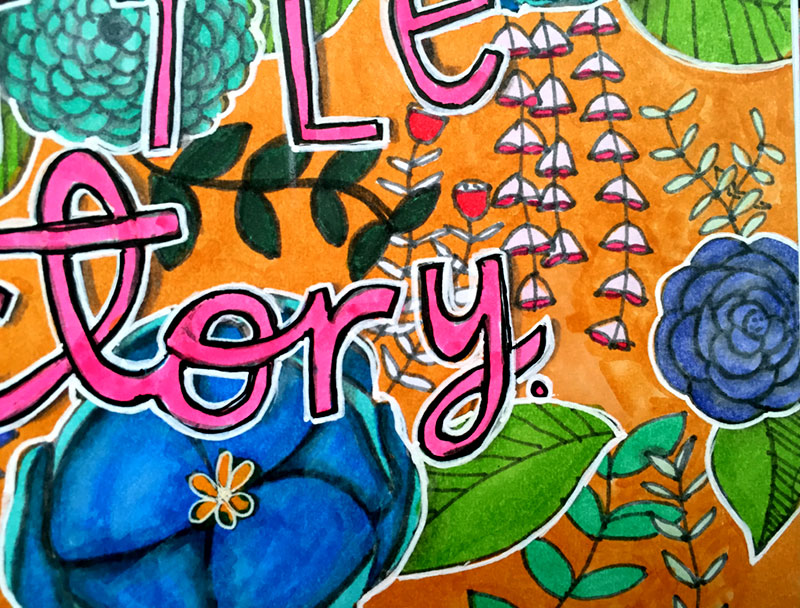
Where is `black leaf plant`? black leaf plant is located at coordinates (330, 210).